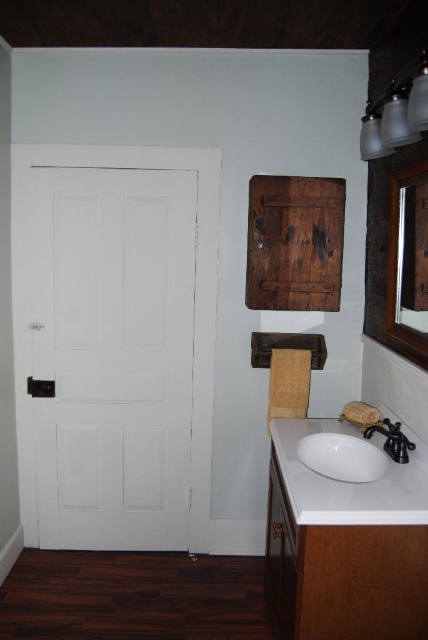
Question: Which point is closer to the camera taking this photo?

Choices:
 (A) (329, 461)
 (B) (397, 454)
 (C) (425, 294)
 (D) (89, 236)

Answer: (B)

Question: Considering the relative positions of white matte door at left and white glossy sink at lower center in the image provided, where is white matte door at left located with respect to white glossy sink at lower center?

Choices:
 (A) above
 (B) below

Answer: (A)

Question: Among these objects, which one is farthest from the camera?

Choices:
 (A) wooden mirror at upper right
 (B) black matte faucet at lower right
 (C) white glossy sink at lower center
 (D) white matte door at left

Answer: (D)

Question: Does wooden mirror at upper right have a lesser width compared to black matte faucet at lower right?

Choices:
 (A) yes
 (B) no

Answer: (A)

Question: Which object is positioned farthest from the black matte faucet at lower right?

Choices:
 (A) white matte door at left
 (B) wooden mirror at upper right

Answer: (A)

Question: Can you confirm if white matte door at left is smaller than black matte faucet at lower right?

Choices:
 (A) yes
 (B) no

Answer: (B)